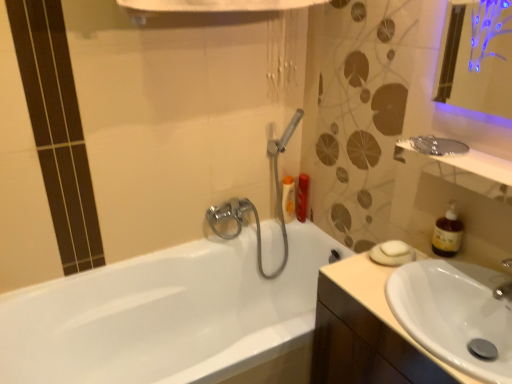
Question: From a real-world perspective, does matte plastic shampoo bottle at upper right, which appears as the 1th toiletry when viewed from the right, sit lower than white glossy sink at lower right?

Choices:
 (A) yes
 (B) no

Answer: (A)

Question: Is matte plastic shampoo bottle at upper right, marked as the 2th toiletry in a left-to-right arrangement, facing towards white glossy sink at lower right?

Choices:
 (A) no
 (B) yes

Answer: (A)

Question: Can you confirm if matte plastic shampoo bottle at upper right, which appears as the 1th toiletry when viewed from the right, is wider than white glossy sink at lower right?

Choices:
 (A) no
 (B) yes

Answer: (A)

Question: Considering the relative sizes of matte plastic shampoo bottle at upper right, marked as the 2th toiletry in a left-to-right arrangement, and white glossy sink at lower right in the image provided, is matte plastic shampoo bottle at upper right, marked as the 2th toiletry in a left-to-right arrangement, taller than white glossy sink at lower right?

Choices:
 (A) no
 (B) yes

Answer: (B)

Question: From the image's perspective, is matte plastic shampoo bottle at upper right, which appears as the 1th toiletry when viewed from the right, above white glossy sink at lower right?

Choices:
 (A) no
 (B) yes

Answer: (B)

Question: From the image's perspective, relative to beige wood cabinet at lower right, is white glossy sink at lower right above or below?

Choices:
 (A) below
 (B) above

Answer: (B)

Question: In the image, is white glossy sink at lower right on the left side or the right side of beige wood cabinet at lower right?

Choices:
 (A) left
 (B) right

Answer: (B)

Question: Considering the positions of white glossy sink at lower right and beige wood cabinet at lower right in the image, is white glossy sink at lower right wider or thinner than beige wood cabinet at lower right?

Choices:
 (A) wide
 (B) thin

Answer: (B)

Question: From a real-world perspective, is white glossy sink at lower right positioned above or below beige wood cabinet at lower right?

Choices:
 (A) below
 (B) above

Answer: (B)

Question: In terms of size, does brown translucent soap dispenser at right appear bigger or smaller than orange matte bottle at upper right, the first toiletry when ordered from left to right?

Choices:
 (A) small
 (B) big

Answer: (A)

Question: Considering the relative positions of brown translucent soap dispenser at right and orange matte bottle at upper right, the first toiletry when ordered from left to right, in the image provided, is brown translucent soap dispenser at right to the left or to the right of orange matte bottle at upper right, the first toiletry when ordered from left to right,?

Choices:
 (A) left
 (B) right

Answer: (B)

Question: From the image's perspective, is brown translucent soap dispenser at right located above or below orange matte bottle at upper right, which appears as the second toiletry when viewed from the right?

Choices:
 (A) below
 (B) above

Answer: (A)

Question: From a real-world perspective, is brown translucent soap dispenser at right positioned above or below orange matte bottle at upper right, which appears as the second toiletry when viewed from the right?

Choices:
 (A) below
 (B) above

Answer: (B)

Question: From their relative heights in the image, would you say metallic silver mirror at upper right is taller or shorter than white glossy bathtub at center?

Choices:
 (A) short
 (B) tall

Answer: (A)

Question: Is metallic silver mirror at upper right bigger or smaller than white glossy bathtub at center?

Choices:
 (A) big
 (B) small

Answer: (B)